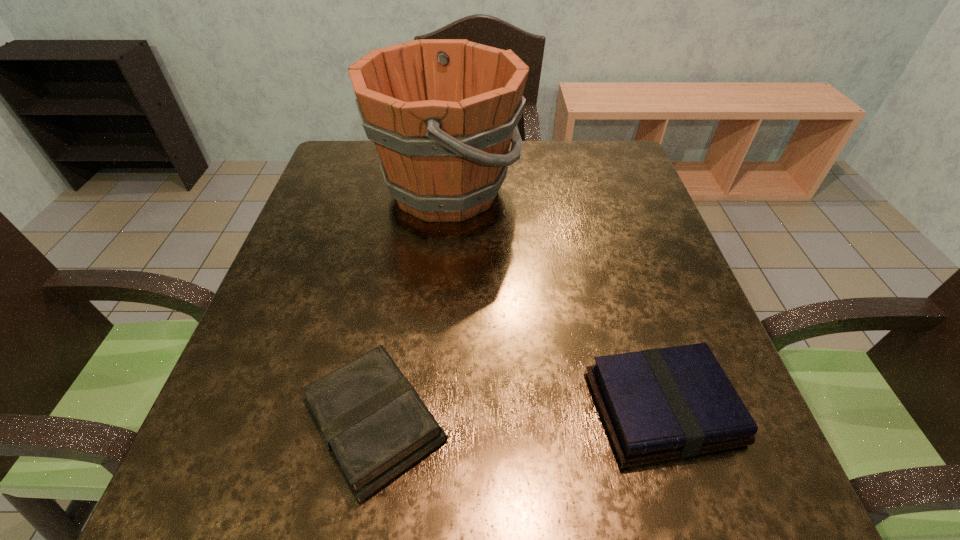
The width and height of the screenshot is (960, 540). I want to click on object located in the right edge section of the desktop, so click(655, 405).

This screenshot has height=540, width=960. Identify the location of object that is at the far left corner. (442, 113).

Image resolution: width=960 pixels, height=540 pixels. Identify the location of object at the near left corner. (372, 421).

At what (x,y) coordinates should I click in order to perform the action: click on object located at the near right corner. Please return your answer as a coordinate pair (x, y). The height and width of the screenshot is (540, 960). Looking at the image, I should click on (655, 405).

What are the coordinates of `vacant space at the near edge` in the screenshot? It's located at (483, 461).

Where is `free space at the left edge of the desktop`? free space at the left edge of the desktop is located at coordinates (357, 192).

The image size is (960, 540). In order to click on vacant space at the right edge in this screenshot , I will do `click(629, 261)`.

The width and height of the screenshot is (960, 540). Identify the location of free space at the far left corner. (348, 162).

Find the location of a particular element. The height and width of the screenshot is (540, 960). vacant space at the near left corner of the desktop is located at coordinates pos(264,469).

The width and height of the screenshot is (960, 540). In the image, there is a desktop. Find the location of `blank space at the far right corner`. blank space at the far right corner is located at coordinates tap(604, 147).